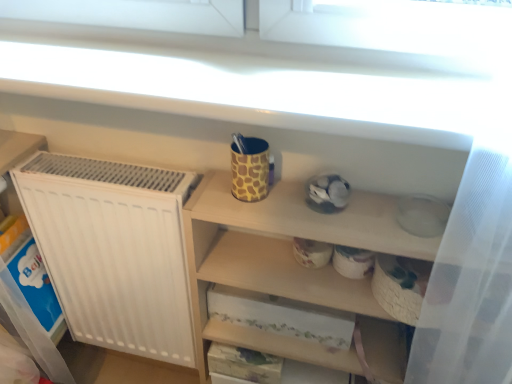
Find the location of a particular element. This screenshot has height=384, width=512. wooden shelf at upper center is located at coordinates (285, 260).

Measure the distance between wooden shelf at upper center and camera.

A distance of 29.51 inches exists between wooden shelf at upper center and camera.

The image size is (512, 384). What do you see at coordinates (285, 260) in the screenshot? I see `wooden shelf at upper center` at bounding box center [285, 260].

What do you see at coordinates (250, 170) in the screenshot? I see `giraffe-patterned ceramic mug at upper center` at bounding box center [250, 170].

The image size is (512, 384). I want to click on giraffe-patterned ceramic mug at upper center, so click(x=250, y=170).

Image resolution: width=512 pixels, height=384 pixels. What are the coordinates of `wooden shelf at upper center` in the screenshot? It's located at (285, 260).

From the picture: Which object is positioned more to the left, wooden shelf at upper center or giraffe-patterned ceramic mug at upper center?

From the viewer's perspective, giraffe-patterned ceramic mug at upper center appears more on the left side.

Which is in front, wooden shelf at upper center or giraffe-patterned ceramic mug at upper center?

wooden shelf at upper center is closer to the camera.

Between point (302, 227) and point (243, 158), which one is positioned in front?

The point (302, 227) is closer to the camera.

From the image's perspective, which is below, wooden shelf at upper center or giraffe-patterned ceramic mug at upper center?

wooden shelf at upper center, from the image's perspective.

From a real-world perspective, does wooden shelf at upper center stand above giraffe-patterned ceramic mug at upper center?

Incorrect, from a real-world perspective, wooden shelf at upper center is lower than giraffe-patterned ceramic mug at upper center.

Can you confirm if wooden shelf at upper center is wider than giraffe-patterned ceramic mug at upper center?

Yes.

Looking at this image, from their relative heights in the image, would you say wooden shelf at upper center is taller or shorter than giraffe-patterned ceramic mug at upper center?

wooden shelf at upper center is taller than giraffe-patterned ceramic mug at upper center.

Does wooden shelf at upper center have a smaller size compared to giraffe-patterned ceramic mug at upper center?

Actually, wooden shelf at upper center might be larger than giraffe-patterned ceramic mug at upper center.

Is giraffe-patterned ceramic mug at upper center a part of wooden shelf at upper center?

No, giraffe-patterned ceramic mug at upper center is not a part of wooden shelf at upper center.

Is wooden shelf at upper center far from giraffe-patterned ceramic mug at upper center?

No, wooden shelf at upper center is not far from giraffe-patterned ceramic mug at upper center.

Is wooden shelf at upper center looking in the opposite direction of giraffe-patterned ceramic mug at upper center?

That's not correct — wooden shelf at upper center is not looking away from giraffe-patterned ceramic mug at upper center.

How many degrees apart are the facing directions of wooden shelf at upper center and giraffe-patterned ceramic mug at upper center?

The angular difference between wooden shelf at upper center and giraffe-patterned ceramic mug at upper center is 0.874 degrees.

You are a GUI agent. You are given a task and a screenshot of the screen. Output one action in this format:
    pyautogui.click(x=<x>, y=<y>)
    Task: Click on the mug above the wooden shelf at upper center (from the image's perspective)
    
    Given the screenshot: What is the action you would take?
    pyautogui.click(x=250, y=170)

Looking at this image, can you confirm if giraffe-patterned ceramic mug at upper center is positioned to the left of wooden shelf at upper center?

Indeed, giraffe-patterned ceramic mug at upper center is positioned on the left side of wooden shelf at upper center.

Considering their positions, is giraffe-patterned ceramic mug at upper center located in front of or behind wooden shelf at upper center?

giraffe-patterned ceramic mug at upper center is behind wooden shelf at upper center.

Which is less distant, (x=266, y=145) or (x=230, y=216)?

Point (x=266, y=145) is farther from the camera than point (x=230, y=216).

From the image's perspective, which object appears higher, giraffe-patterned ceramic mug at upper center or wooden shelf at upper center?

giraffe-patterned ceramic mug at upper center, from the image's perspective.

From a real-world perspective, relative to wooden shelf at upper center, is giraffe-patterned ceramic mug at upper center vertically above or below?

In terms of real-world spatial position, giraffe-patterned ceramic mug at upper center is above wooden shelf at upper center.

Which object is thinner, giraffe-patterned ceramic mug at upper center or wooden shelf at upper center?

giraffe-patterned ceramic mug at upper center is thinner.

Which of these two, giraffe-patterned ceramic mug at upper center or wooden shelf at upper center, stands shorter?

Standing shorter between the two is giraffe-patterned ceramic mug at upper center.

Does giraffe-patterned ceramic mug at upper center have a smaller size compared to wooden shelf at upper center?

Correct, giraffe-patterned ceramic mug at upper center occupies less space than wooden shelf at upper center.

Is giraffe-patterned ceramic mug at upper center inside the boundaries of wooden shelf at upper center, or outside?

giraffe-patterned ceramic mug at upper center is located beyond the bounds of wooden shelf at upper center.

Is giraffe-patterned ceramic mug at upper center positioned far away from wooden shelf at upper center?

No, there isn't a large distance between giraffe-patterned ceramic mug at upper center and wooden shelf at upper center.

Could you tell me if giraffe-patterned ceramic mug at upper center is facing wooden shelf at upper center?

No, giraffe-patterned ceramic mug at upper center is not aimed at wooden shelf at upper center.

How distant is giraffe-patterned ceramic mug at upper center from wooden shelf at upper center?

giraffe-patterned ceramic mug at upper center is 8.50 inches away from wooden shelf at upper center.

Where is `mug that is behind the wooden shelf at upper center`? The width and height of the screenshot is (512, 384). mug that is behind the wooden shelf at upper center is located at coordinates (250, 170).

The height and width of the screenshot is (384, 512). Identify the location of cabinet in front of the giraffe-patterned ceramic mug at upper center. (285, 260).

This screenshot has width=512, height=384. What are the coordinates of `mug that is above the wooden shelf at upper center (from a real-world perspective)` in the screenshot? It's located at (250, 170).